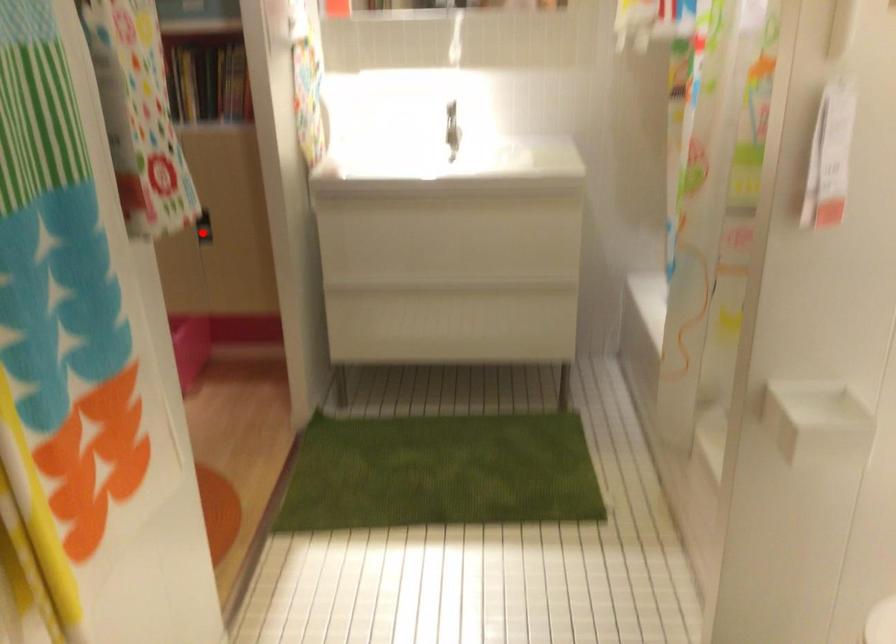
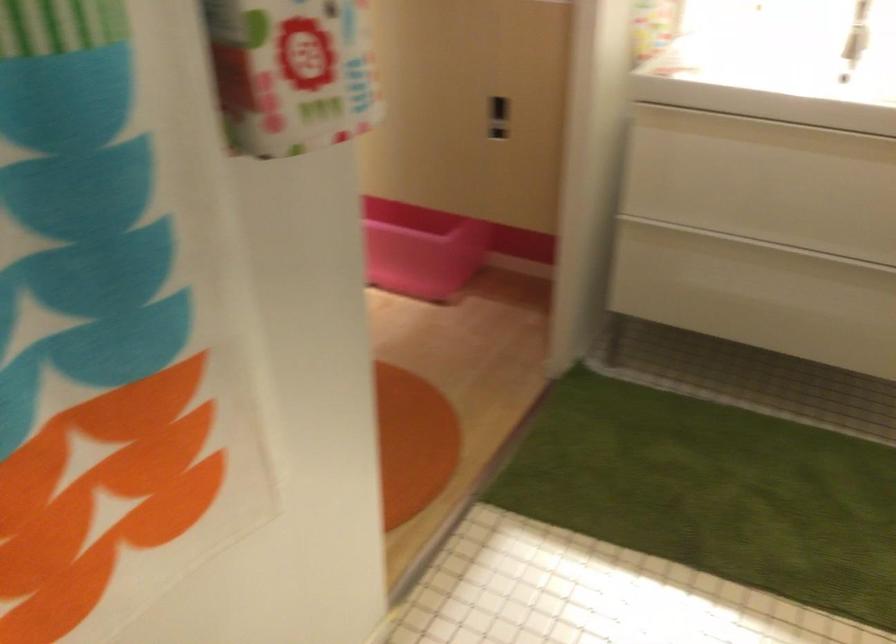
Question: A red point is marked in image1. In image2, is the corresponding 3D point closer to the camera or farther? Reply with the corresponding letter.

Choices:
 (A) The corresponding 3D point is closer.
 (B) The corresponding 3D point is farther.

Answer: (A)